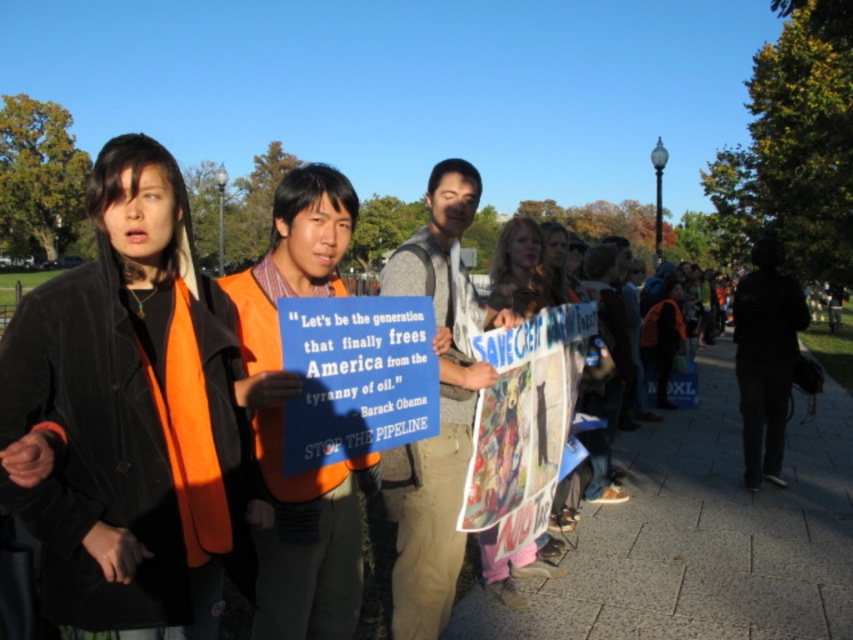
Question: Which point is farther to the camera?

Choices:
 (A) (610, 269)
 (B) (695, 435)
 (C) (538, 260)

Answer: (B)

Question: Where is matte blue sign at center located in relation to orange safety vest at center in the image?

Choices:
 (A) below
 (B) above

Answer: (A)

Question: Among these points, which one is farthest from the camera?

Choices:
 (A) (592, 406)
 (B) (401, 256)

Answer: (A)

Question: Which is nearer to the velvet black coat at center?

Choices:
 (A) blue denim jacket at lower right
 (B) gray concrete pavement at lower right

Answer: (B)

Question: Observing the image, what is the correct spatial positioning of orange reflective vest at center in reference to orange safety vest at center?

Choices:
 (A) right
 (B) left

Answer: (B)

Question: Does orange safety vest at center have a lesser width compared to blue denim jacket at lower right?

Choices:
 (A) no
 (B) yes

Answer: (B)